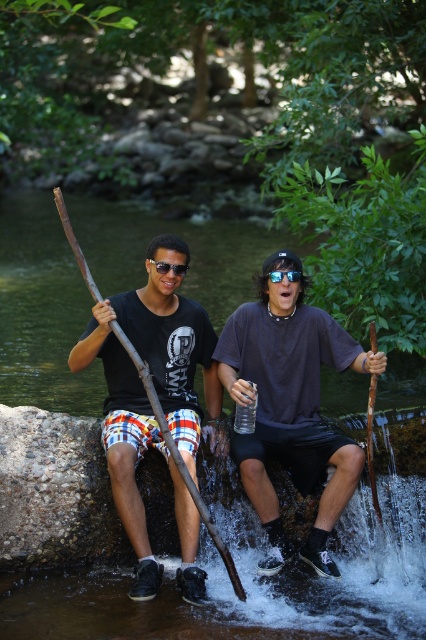
You are planning to pick up the brown wood paddle at left and the wooden stick at right. Which object will you reach first if you move towards them from the front of the image?

You will reach the brown wood paddle at left first because it is closer to the viewer than the wooden stick at right.

You are a hiker trying to decide which stick to use for support. The matte brown stick at center and the wooden stick at right are both available. Which stick is closer to your left side?

The matte brown stick at center is positioned on the left side of wooden stick at right, so the matte brown stick at center is closer to your left side.

You are planning to retrieve the matte brown stick at center and the brown wood paddle at left from the rocky ledge. Which object should you reach for first if you want to pick up the one closer to you?

The matte brown stick at center is closer to you because the brown wood paddle at left is behind it.